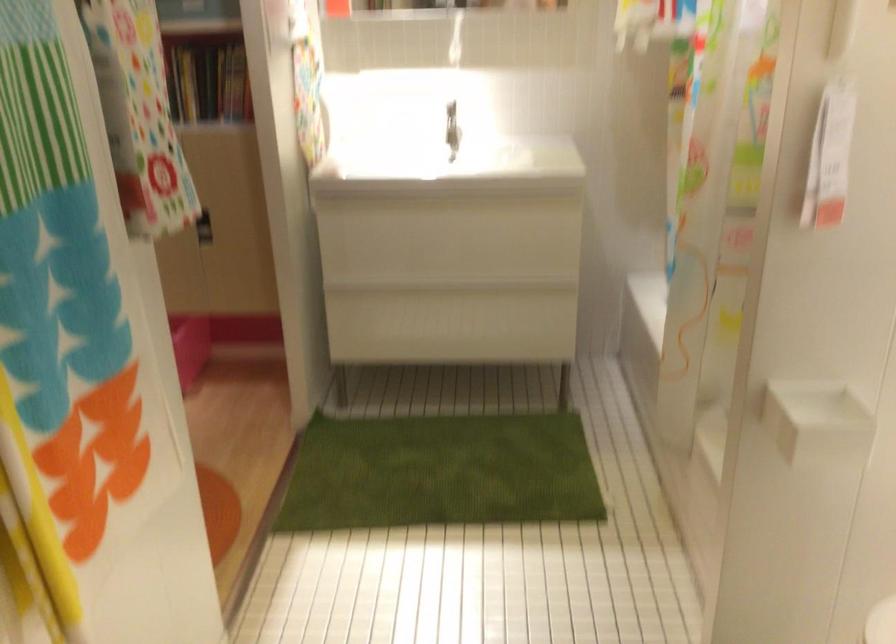
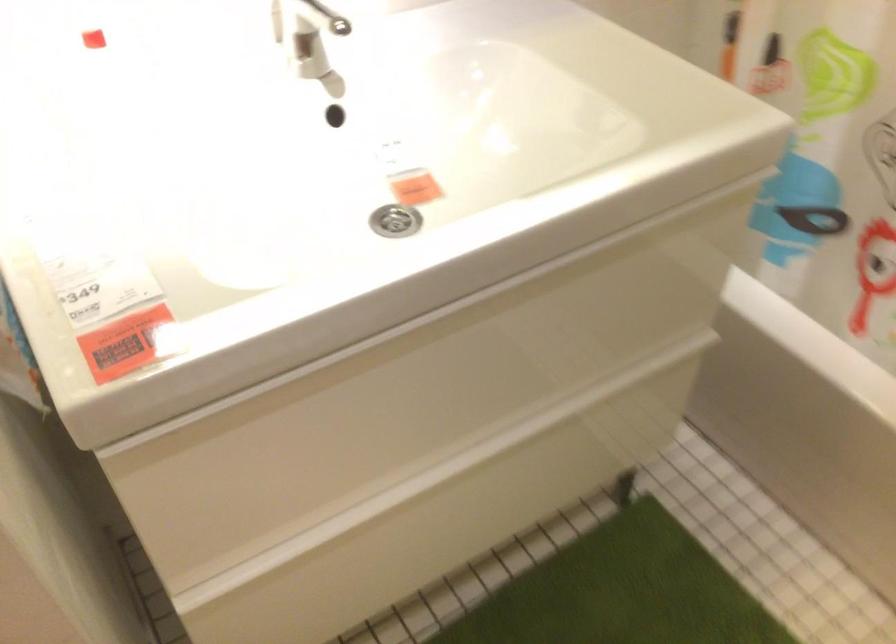
Locate, in the second image, the point that corresponds to point 433,312 in the first image.

(442, 514)